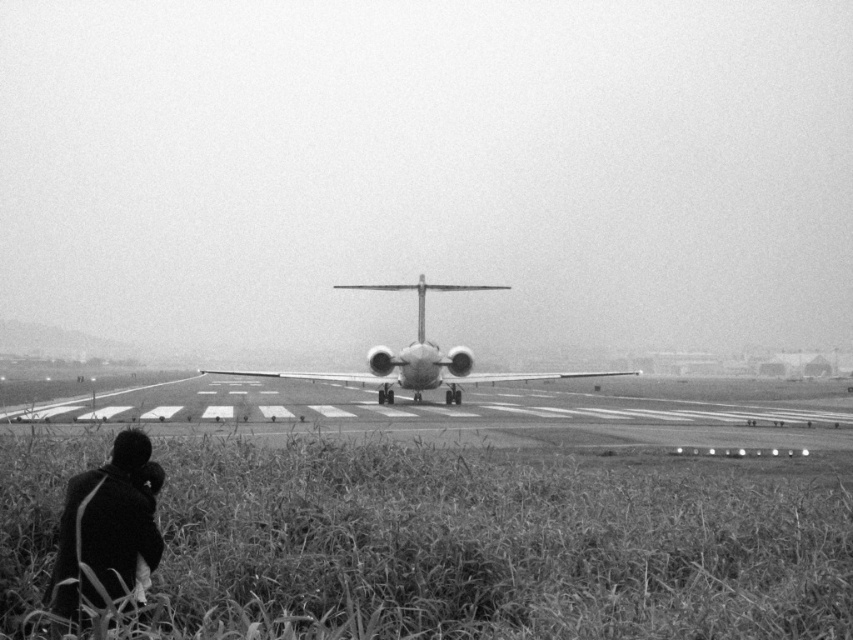
Question: Can you confirm if dark fabric coat at lower left is positioned below metallic airplane at center?

Choices:
 (A) yes
 (B) no

Answer: (A)

Question: Which object appears farthest from the camera in this image?

Choices:
 (A) dark fabric coat at lower left
 (B) metallic airplane at center

Answer: (B)

Question: Is dark fabric coat at lower left positioned behind metallic airplane at center?

Choices:
 (A) yes
 (B) no

Answer: (B)

Question: Does dark fabric coat at lower left appear over metallic airplane at center?

Choices:
 (A) yes
 (B) no

Answer: (B)

Question: Among these objects, which one is farthest from the camera?

Choices:
 (A) metallic airplane at center
 (B) dark fabric coat at lower left

Answer: (A)